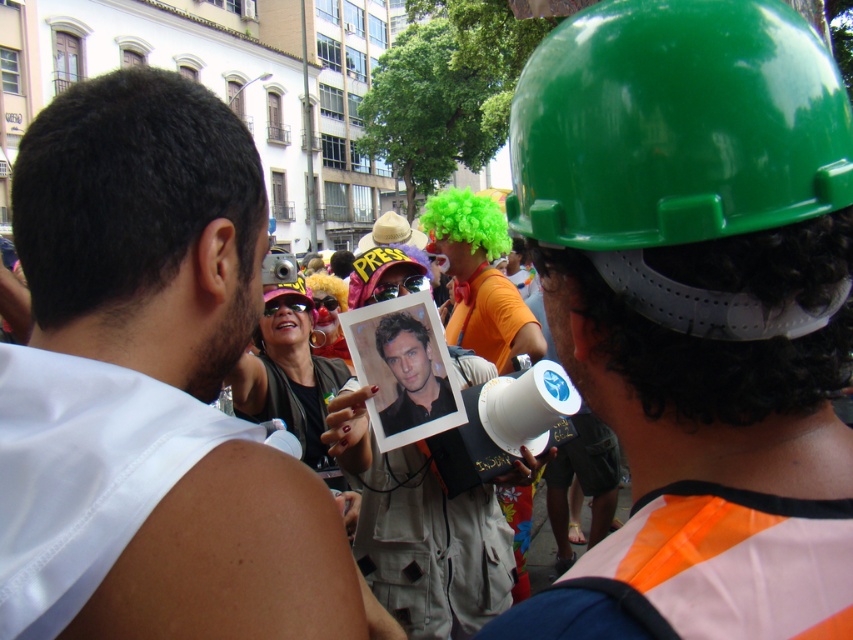
Question: Which object is positioned farthest from the matte black photo at center?

Choices:
 (A) green glossy helmet at upper right
 (B) white fabric at left

Answer: (A)

Question: Can you confirm if green hard hat at right is positioned above green glossy helmet at upper right?

Choices:
 (A) no
 (B) yes

Answer: (A)

Question: Is white fabric at left thinner than smooth black shirt at center?

Choices:
 (A) no
 (B) yes

Answer: (A)

Question: Which is nearer to the white fabric at left?

Choices:
 (A) green hard hat at right
 (B) green glossy helmet at upper right

Answer: (B)

Question: Is green hard hat at right below white fabric at left?

Choices:
 (A) yes
 (B) no

Answer: (A)

Question: Which of the following is the closest to the observer?

Choices:
 (A) (556, 186)
 (B) (386, 349)
 (C) (257, 593)
 (D) (380, 244)

Answer: (A)